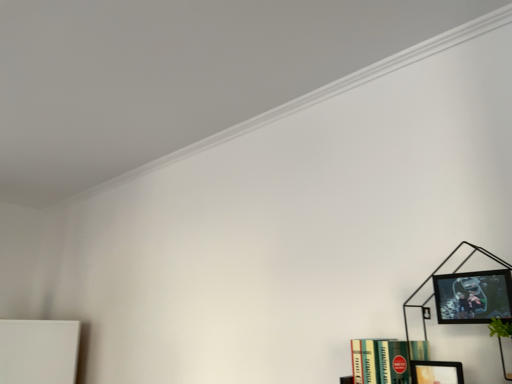
Question: Considering the relative sizes of matte black picture frame at lower right, which is the first picture frame from bottom to top, and green matte book at lower right in the image provided, is matte black picture frame at lower right, which is the first picture frame from bottom to top, taller than green matte book at lower right?

Choices:
 (A) yes
 (B) no

Answer: (B)

Question: Is matte black picture frame at lower right, which is the second picture frame from top to bottom, at the left side of green matte book at lower right?

Choices:
 (A) no
 (B) yes

Answer: (A)

Question: Are matte black picture frame at lower right, which is the first picture frame from bottom to top, and green matte book at lower right far apart?

Choices:
 (A) no
 (B) yes

Answer: (A)

Question: From a real-world perspective, is matte black picture frame at lower right, which is the first picture frame from bottom to top, positioned over green matte book at lower right based on gravity?

Choices:
 (A) yes
 (B) no

Answer: (B)

Question: Is the depth of matte black picture frame at lower right, which is the second picture frame from top to bottom, less than that of green matte book at lower right?

Choices:
 (A) yes
 (B) no

Answer: (A)

Question: Looking at the image, does green matte book at lower right seem bigger or smaller compared to black matte bookcase at right?

Choices:
 (A) small
 (B) big

Answer: (A)

Question: Considering their positions, is green matte book at lower right located in front of or behind black matte bookcase at right?

Choices:
 (A) front
 (B) behind

Answer: (B)

Question: Is green matte book at lower right spatially inside black matte bookcase at right, or outside of it?

Choices:
 (A) outside
 (B) inside

Answer: (A)

Question: Looking at their shapes, would you say green matte book at lower right is wider or thinner than black matte bookcase at right?

Choices:
 (A) wide
 (B) thin

Answer: (B)

Question: From the image's perspective, is black matte bookcase at right above or below green matte book at lower right?

Choices:
 (A) below
 (B) above

Answer: (B)

Question: Is black matte bookcase at right wider or thinner than green matte book at lower right?

Choices:
 (A) wide
 (B) thin

Answer: (A)

Question: From a real-world perspective, is black matte bookcase at right physically located above or below green matte book at lower right?

Choices:
 (A) below
 (B) above

Answer: (B)

Question: In terms of height, does black matte bookcase at right look taller or shorter compared to green matte book at lower right?

Choices:
 (A) tall
 (B) short

Answer: (A)

Question: From a real-world perspective, is black matte bookcase at right physically located above or below matte black picture frame at upper right, which is the 2th picture frame from bottom to top?

Choices:
 (A) above
 (B) below

Answer: (B)

Question: Is point (371, 377) positioned closer to the camera than point (462, 283)?

Choices:
 (A) closer
 (B) farther

Answer: (B)